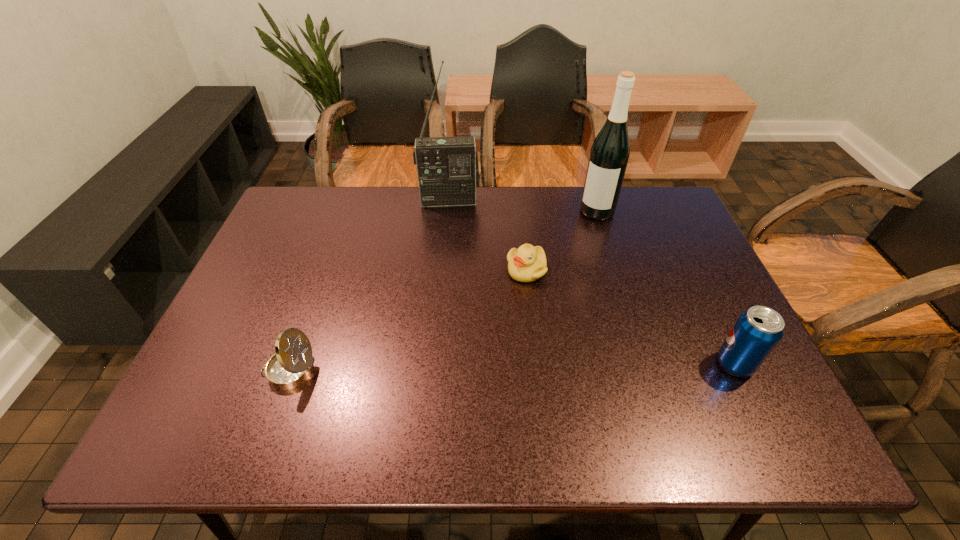
Identify the location of free space on the desktop that is between the fourth tallest object and the third tallest object and is positioned at the face of the duckling. This screenshot has width=960, height=540. (468, 368).

Where is `free space on the desktop that is between the second shortest object and the rightmost object and is positioned on the label of the second object from right to left`? This screenshot has width=960, height=540. free space on the desktop that is between the second shortest object and the rightmost object and is positioned on the label of the second object from right to left is located at coordinates (511, 367).

Where is `vacant space on the desktop that is between the compass and the third tallest object and is positioned on the display of the fourth object from right to left`? The height and width of the screenshot is (540, 960). vacant space on the desktop that is between the compass and the third tallest object and is positioned on the display of the fourth object from right to left is located at coordinates (454, 368).